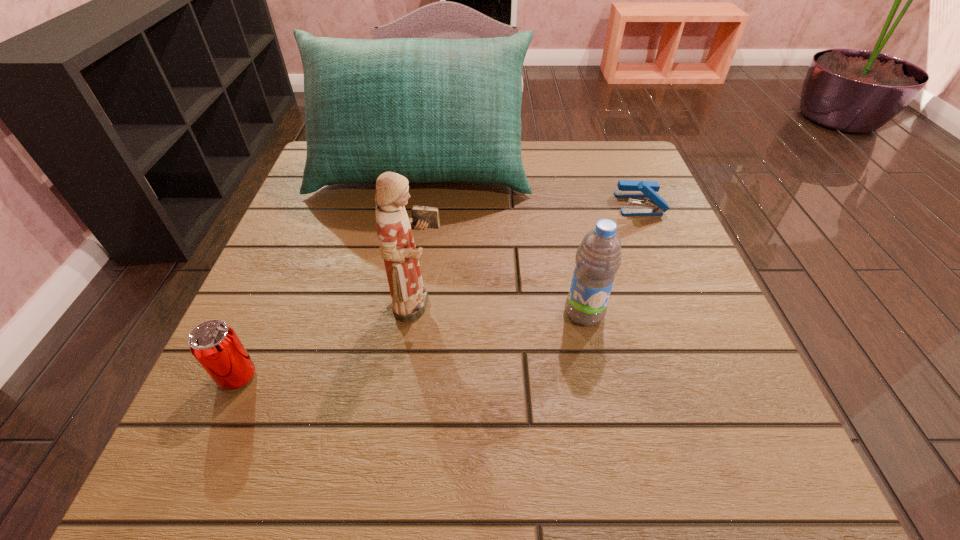
Locate an element on the screen. This screenshot has width=960, height=540. free space at the near edge of the desktop is located at coordinates (373, 456).

Locate an element on the screen. vacant area at the left edge is located at coordinates (306, 292).

Image resolution: width=960 pixels, height=540 pixels. In the image, there is a desktop. Identify the location of vacant space at the right edge. (668, 223).

The image size is (960, 540). Identify the location of blank space at the near left corner. (279, 488).

Locate an element on the screen. The width and height of the screenshot is (960, 540). free space at the far right corner of the desktop is located at coordinates [595, 157].

You are a GUI agent. You are given a task and a screenshot of the screen. Output one action in this format:
    pyautogui.click(x=<x>, y=<y>)
    Task: Click on the vacant space that's between the figurine and the water bottle
    The image size is (960, 540).
    Given the screenshot: What is the action you would take?
    pyautogui.click(x=502, y=309)

The image size is (960, 540). Find the location of `free space between the fourth tallest object and the cushion`. free space between the fourth tallest object and the cushion is located at coordinates (329, 274).

Where is `vacant region between the water bottle and the figurine`? The image size is (960, 540). vacant region between the water bottle and the figurine is located at coordinates (502, 309).

Where is `free space between the third tallest object and the figurine`? The height and width of the screenshot is (540, 960). free space between the third tallest object and the figurine is located at coordinates (502, 309).

You are a GUI agent. You are given a task and a screenshot of the screen. Output one action in this format:
    pyautogui.click(x=<x>, y=<y>)
    Task: Click on the empty space between the soda can and the rightmost object
    The width and height of the screenshot is (960, 540).
    Given the screenshot: What is the action you would take?
    pyautogui.click(x=439, y=290)